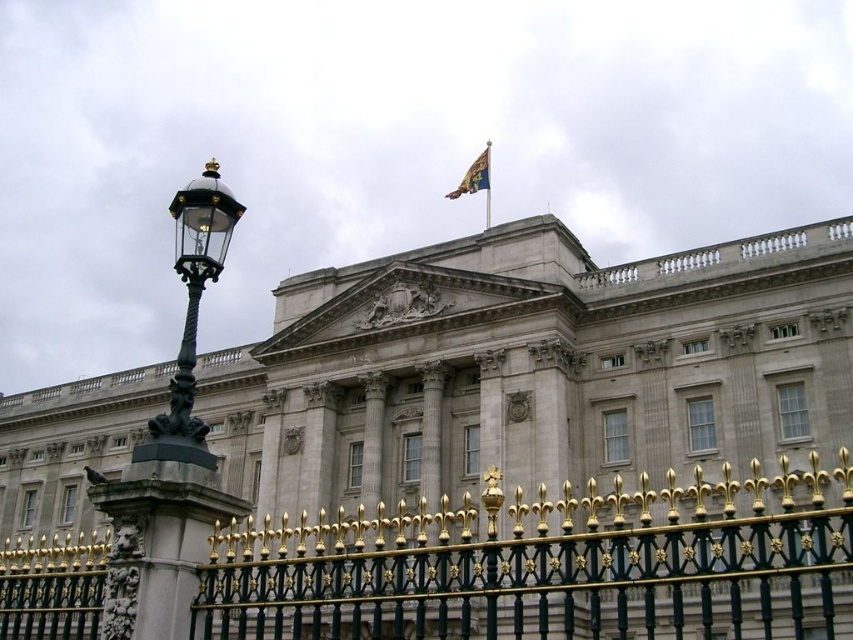
Does point (531, 609) come behind point (486, 148)?

No, (531, 609) is in front of (486, 148).

Can you confirm if gold wrought iron fence at center is shorter than gold metallic flag pole at upper center?

In fact, gold wrought iron fence at center may be taller than gold metallic flag pole at upper center.

Between point (352, 531) and point (486, 225), which one is positioned in front?

Positioned in front is point (352, 531).

The width and height of the screenshot is (853, 640). I want to click on gold wrought iron fence at center, so click(x=549, y=564).

Does point (515, 282) come behind point (485, 161)?

No, it is in front of (485, 161).

Describe the element at coordinates (531, 372) in the screenshot. The width and height of the screenshot is (853, 640). I see `stone facade building at center` at that location.

Where is `stone facade building at center`? This screenshot has height=640, width=853. stone facade building at center is located at coordinates (531, 372).

Is stone facade building at center below gold metallic flag pole at upper center?

Correct, stone facade building at center is located below gold metallic flag pole at upper center.

Can you confirm if stone facade building at center is bigger than gold metallic flag pole at upper center?

Correct, stone facade building at center is larger in size than gold metallic flag pole at upper center.

Is point (671, 365) closer to viewer compared to point (485, 168)?

Yes.

Find the location of a particular element. stone facade building at center is located at coordinates (531, 372).